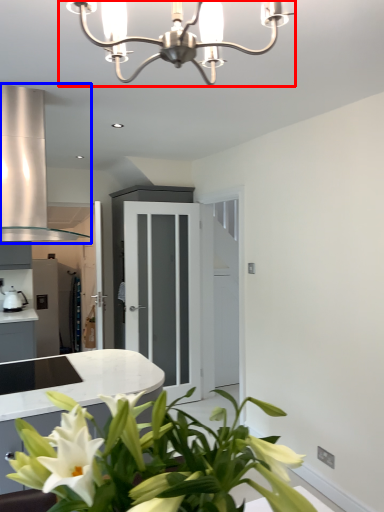
Question: Which object is further to the camera taking this photo, lamp (highlighted by a red box) or exhaust hood (highlighted by a blue box)?

Choices:
 (A) lamp
 (B) exhaust hood

Answer: (B)